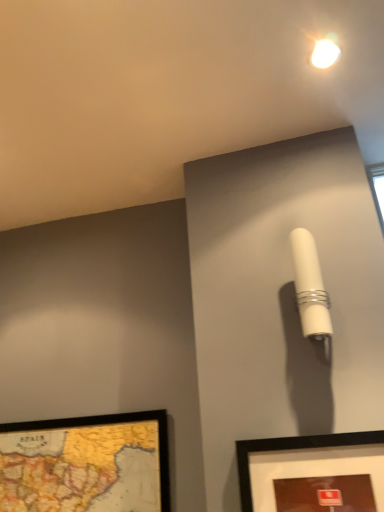
Question: Can you confirm if white glossy droplight at upper center is positioned to the right of matte black picture frame at lower right, the first picture frame when ordered from right to left?

Choices:
 (A) no
 (B) yes

Answer: (B)

Question: From the image's perspective, would you say white glossy droplight at upper center is positioned over matte black picture frame at lower right, which ranks as the second picture frame in back-to-front order?

Choices:
 (A) no
 (B) yes

Answer: (B)

Question: Considering the relative positions of white glossy droplight at upper center and matte black picture frame at lower right, the first picture frame when ordered from right to left, in the image provided, is white glossy droplight at upper center to the left of matte black picture frame at lower right, the first picture frame when ordered from right to left, from the viewer's perspective?

Choices:
 (A) yes
 (B) no

Answer: (B)

Question: Can you confirm if white glossy droplight at upper center is thinner than matte black picture frame at lower right, the first picture frame when ordered from right to left?

Choices:
 (A) yes
 (B) no

Answer: (B)

Question: Is white glossy droplight at upper center bigger than matte black picture frame at lower right, which ranks as the second picture frame in back-to-front order?

Choices:
 (A) no
 (B) yes

Answer: (A)

Question: Can you confirm if white glossy droplight at upper center is smaller than matte black picture frame at lower right, the first picture frame when ordered from right to left?

Choices:
 (A) no
 (B) yes

Answer: (B)

Question: Considering the relative sizes of white matte cylindrical lamp at upper right and wooden map frame at lower left, marked as the second picture frame in a front-to-back arrangement, in the image provided, is white matte cylindrical lamp at upper right taller than wooden map frame at lower left, marked as the second picture frame in a front-to-back arrangement,?

Choices:
 (A) no
 (B) yes

Answer: (B)

Question: Does white matte cylindrical lamp at upper right have a lesser height compared to wooden map frame at lower left, positioned as the 1th picture frame in left-to-right order?

Choices:
 (A) no
 (B) yes

Answer: (A)

Question: Is white matte cylindrical lamp at upper right looking in the opposite direction of wooden map frame at lower left, which is the 2th picture frame from right to left?

Choices:
 (A) yes
 (B) no

Answer: (B)

Question: Could wooden map frame at lower left, marked as the second picture frame in a front-to-back arrangement, be considered to be inside white matte cylindrical lamp at upper right?

Choices:
 (A) no
 (B) yes

Answer: (A)

Question: From a real-world perspective, is white matte cylindrical lamp at upper right located beneath wooden map frame at lower left, the 1th picture frame viewed from the back?

Choices:
 (A) yes
 (B) no

Answer: (B)

Question: From the image's perspective, would you say white matte cylindrical lamp at upper right is shown under wooden map frame at lower left, which is the 2th picture frame from right to left?

Choices:
 (A) no
 (B) yes

Answer: (A)

Question: Is matte black picture frame at lower right, which ranks as the second picture frame in back-to-front order, not inside white glossy droplight at upper center?

Choices:
 (A) no
 (B) yes

Answer: (B)